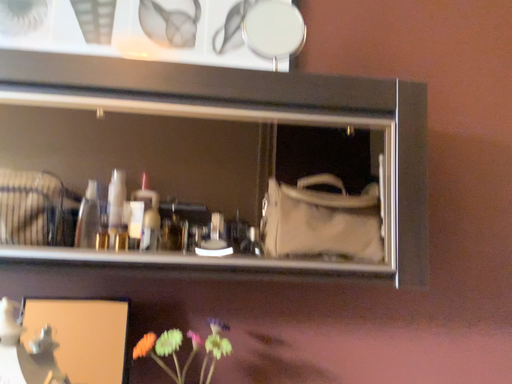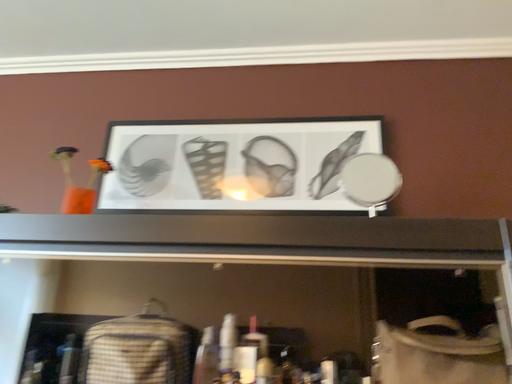
Question: Which way did the camera rotate in the video?

Choices:
 (A) rotated upward
 (B) rotated downward

Answer: (A)